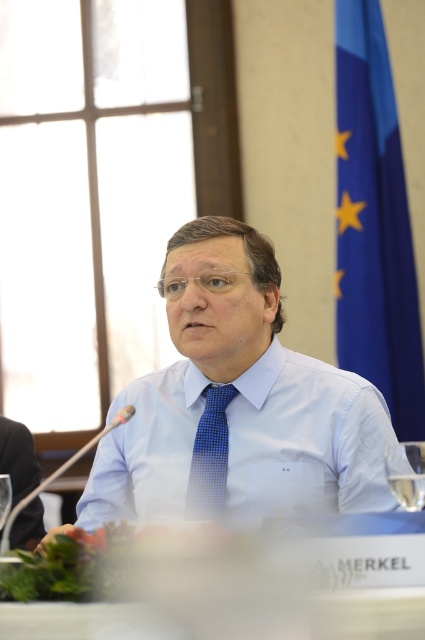
You are an event organizer preparing for a photo shoot in this conference room. You need to ensure that the light blue shirt at center and the blue dotted tie at center are visible in the frame. Given their sizes, which object should you focus on first to ensure both are in the shot?

The light blue shirt at center has a greater height compared to the blue dotted tie at center, so you should focus on framing the light blue shirt at center first since it is larger and will require more space in the photo.

You are attending a conference and see the light blue shirt at center and the blue dotted tie at center. Which one is closer to you?

The light blue shirt at center is closer to you since it is in front of the blue dotted tie at center.